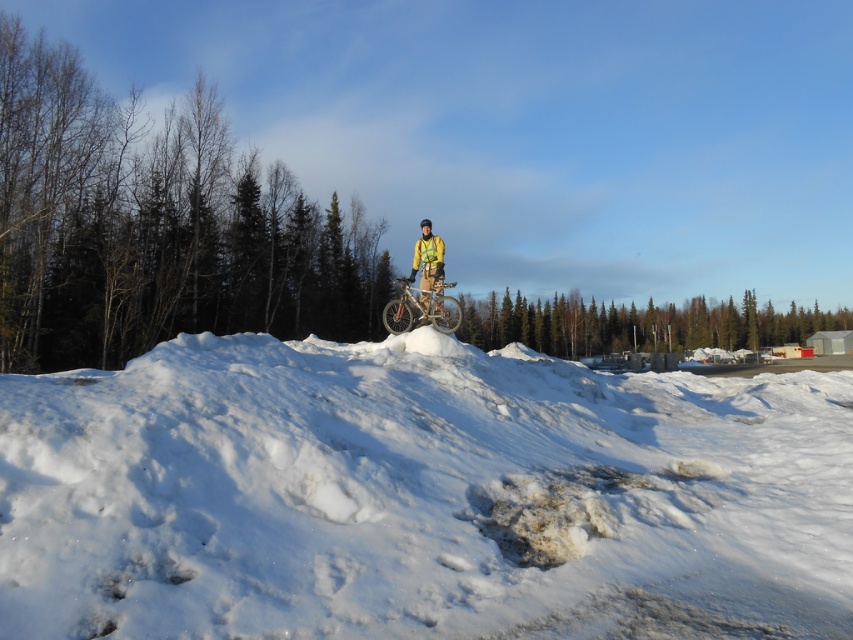
You are a photographer trying to capture the winter scene. You notice the white fluffy snow at center and the yellow fabric jacket at center. Which object is positioned closer to your camera lens?

The white fluffy snow at center is closer to the viewer than the yellow fabric jacket at center, so the snow will appear closer to the camera lens in the photograph.